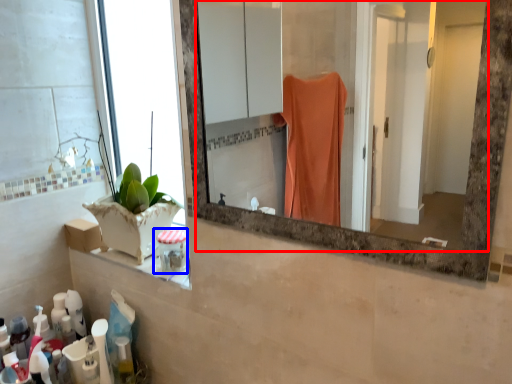
Question: Which of the following is the closest to the observer, mirror (highlighted by a red box) or toiletry (highlighted by a blue box)?

Choices:
 (A) mirror
 (B) toiletry

Answer: (A)